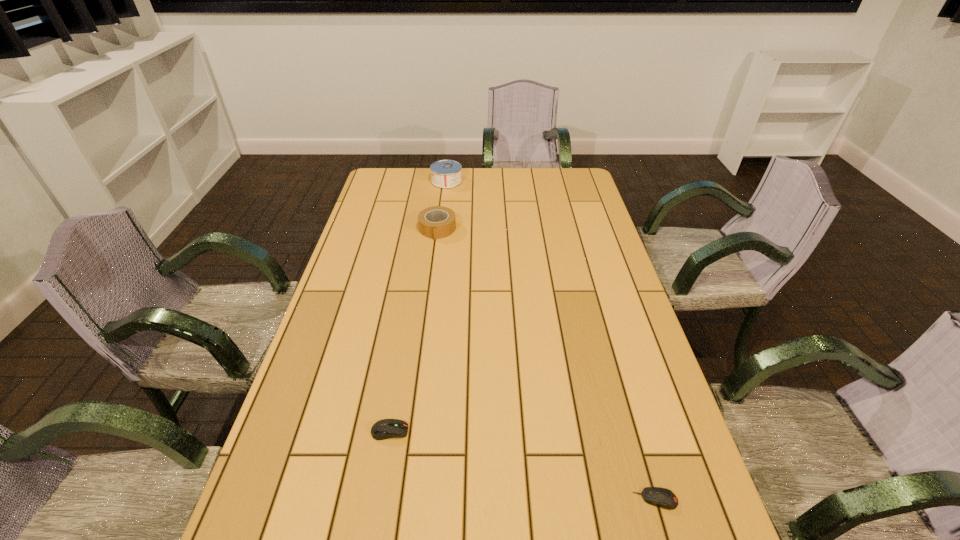
Where is `the farthest object`? This screenshot has width=960, height=540. the farthest object is located at coordinates (445, 174).

Find the location of a particular element. can is located at coordinates (445, 174).

The image size is (960, 540). Identify the location of the second tallest object. (435, 222).

Where is `the second farthest object`? the second farthest object is located at coordinates (435, 222).

At what (x,y) coordinates should I click in order to perform the action: click on the second shortest object. Please return your answer as a coordinate pair (x, y). Image resolution: width=960 pixels, height=540 pixels. Looking at the image, I should click on (383, 429).

The height and width of the screenshot is (540, 960). I want to click on the left computer mouse, so click(x=383, y=429).

You are a GUI agent. You are given a task and a screenshot of the screen. Output one action in this format:
    pyautogui.click(x=<x>, y=<y>)
    Task: Click on the shortest object
    The height and width of the screenshot is (540, 960).
    Given the screenshot: What is the action you would take?
    pyautogui.click(x=661, y=497)

Find the location of `the nearer computer mouse`. the nearer computer mouse is located at coordinates (661, 497).

Image resolution: width=960 pixels, height=540 pixels. Identify the location of vacant space situated on the right of the farthest object. (486, 181).

This screenshot has width=960, height=540. Identify the location of free space located 0.140m at the edge of the third nearest object. (433, 266).